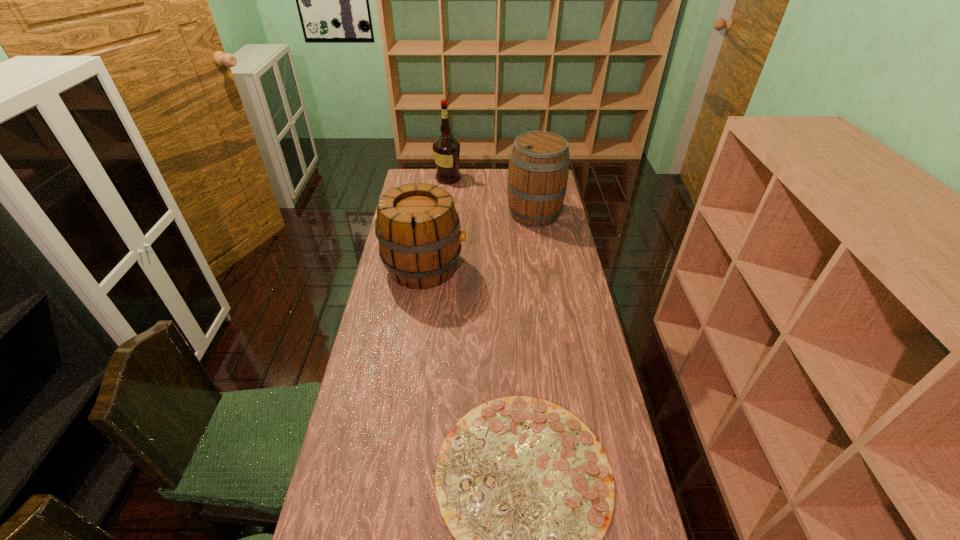
I want to click on cider at the left edge, so click(418, 229).

In order to click on object that is at the right edge in this screenshot , I will do `click(538, 170)`.

You are a GUI agent. You are given a task and a screenshot of the screen. Output one action in this format:
    pyautogui.click(x=<x>, y=<y>)
    Task: Click on the object positioned at the far left corner
    Image resolution: width=960 pixels, height=540 pixels.
    Given the screenshot: What is the action you would take?
    pyautogui.click(x=446, y=149)

In the image, there is a desktop. In order to click on vacant space at the far edge in this screenshot , I will do `click(444, 189)`.

This screenshot has width=960, height=540. In order to click on vacant space at the left edge in this screenshot , I will do `click(396, 312)`.

At what (x,y) coordinates should I click in order to perform the action: click on vacant space at the right edge. Please return your answer as a coordinate pair (x, y). The width and height of the screenshot is (960, 540). Looking at the image, I should click on [x=586, y=338].

At what (x,y) coordinates should I click in order to perform the action: click on vacant area between the farthest object and the farther cider. Please return your answer as a coordinate pair (x, y). This screenshot has width=960, height=540. Looking at the image, I should click on (492, 196).

Identify the location of empty space that is in between the farthest object and the right cider. (492, 196).

At what (x,y) coordinates should I click in order to perform the action: click on empty location between the second farthest object and the shorter cider. Please return your answer as a coordinate pair (x, y). The width and height of the screenshot is (960, 540). Looking at the image, I should click on (480, 240).

Locate an element on the screen. vacant point located between the alcohol and the third nearest object is located at coordinates (492, 196).